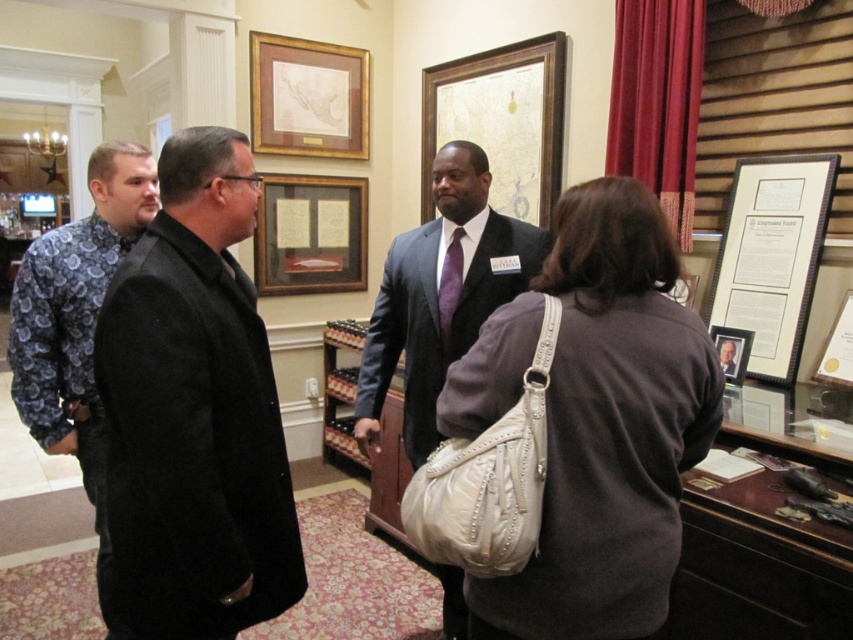
From the picture: You are an art curator arranging an exhibition. You have two frames available for display in the center of the room. The wooden frame at center and the matte black frame at center. Which frame should you choose if you want to create a focal point with a larger visual impact?

The wooden frame at center has a larger size compared to the matte black frame at center, so it would create a larger visual impact as a focal point.

You are standing at point (741, 372) and want to walk to the exit located at point (283, 250). Is the exit directly in front of you or behind you?

The exit at point (283, 250) is behind you relative to your current position at point (741, 372), so you should turn around to face the exit.

You are an interior designer observing the scene. You need to place a new decorative item between the matte gold picture frame at right and the wooden frame at center. Based on their current positions, where should you place the new item to maintain symmetry?

The matte gold picture frame at right is positioned on the right side of wooden frame at center, so placing the new decorative item to the left of the wooden frame at center would create symmetry.